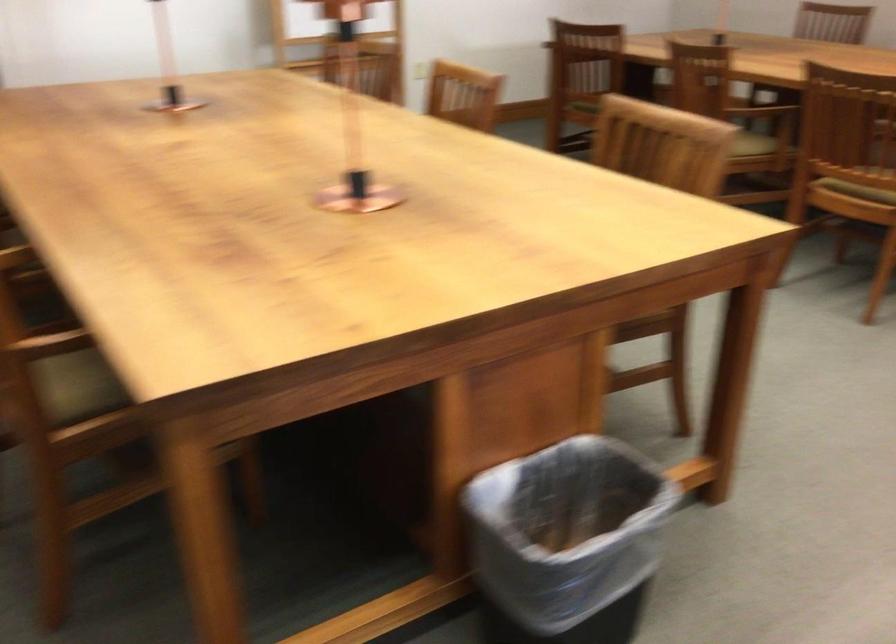
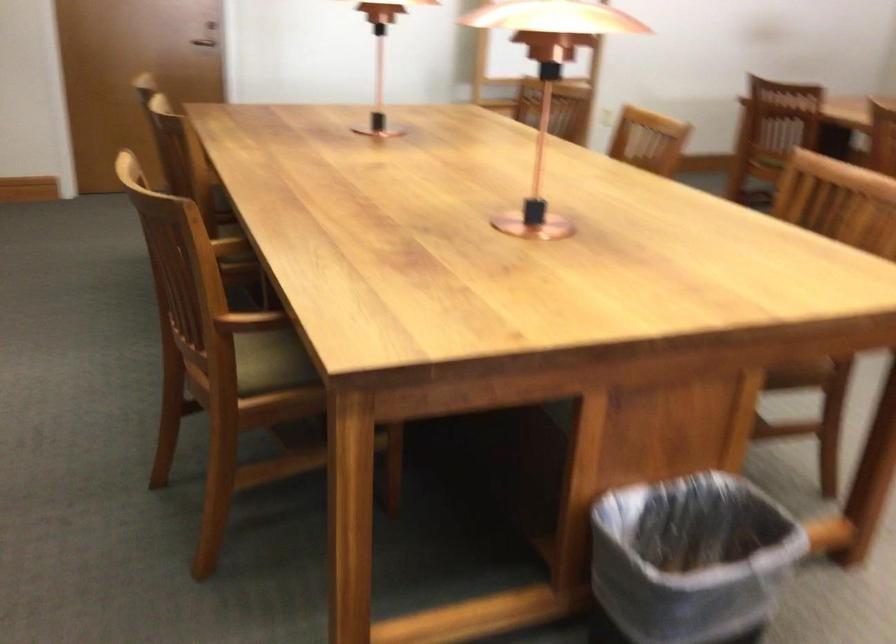
Locate, in the second image, the point that corresponds to (x=584, y=109) in the first image.

(767, 162)